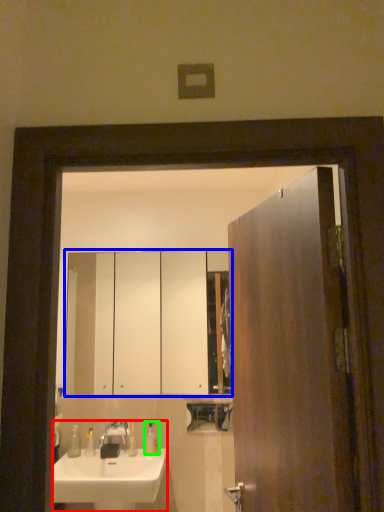
Question: Considering the real-world distances, which object is closest to sink (highlighted by a red box)? cabinetry (highlighted by a blue box) or soap dispenser (highlighted by a green box).

Choices:
 (A) cabinetry
 (B) soap dispenser

Answer: (B)